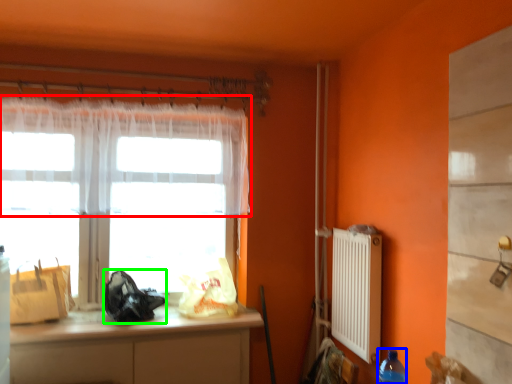
Question: Which object is positioned farthest from curtain (highlighted by a red box)? Select from bottle (highlighted by a blue box) and bag (highlighted by a green box).

Choices:
 (A) bottle
 (B) bag

Answer: (A)